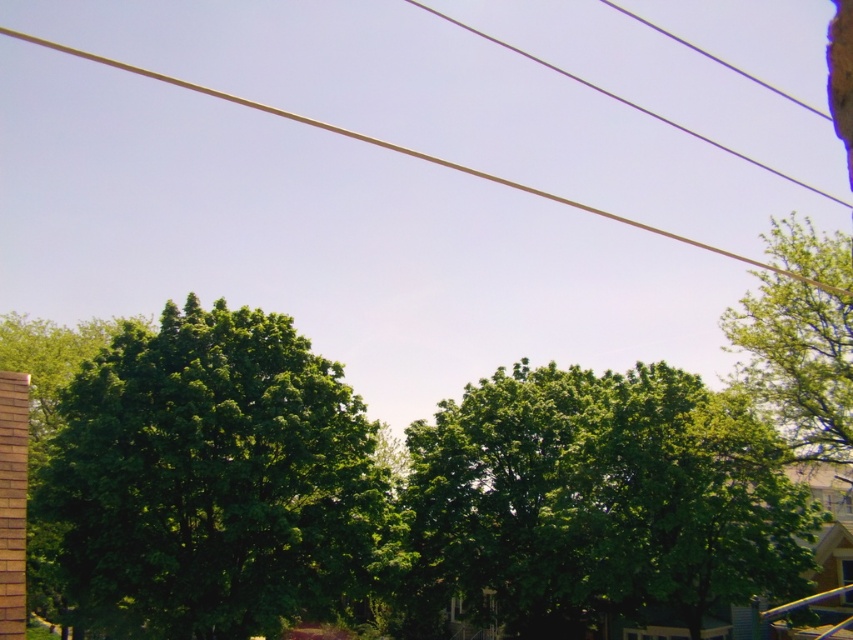
Question: In this image, where is green leafy tree at left located relative to green leafy tree at upper right?

Choices:
 (A) below
 (B) above

Answer: (A)

Question: Estimate the real-world distances between objects in this image. Which object is closer to the green leafy tree at upper right?

Choices:
 (A) green leafy tree at left
 (B) smooth wire at upper center

Answer: (A)

Question: Which object appears farthest from the camera in this image?

Choices:
 (A) smooth wire at upper center
 (B) green leafy tree at center

Answer: (B)

Question: Can you confirm if green leafy tree at center is wider than smooth wire at upper center?

Choices:
 (A) yes
 (B) no

Answer: (B)

Question: Among these points, which one is nearest to the camera?

Choices:
 (A) (793, 320)
 (B) (202, 90)
 (C) (161, 352)

Answer: (A)

Question: Is green leafy tree at left below green leafy tree at center?

Choices:
 (A) yes
 (B) no

Answer: (B)